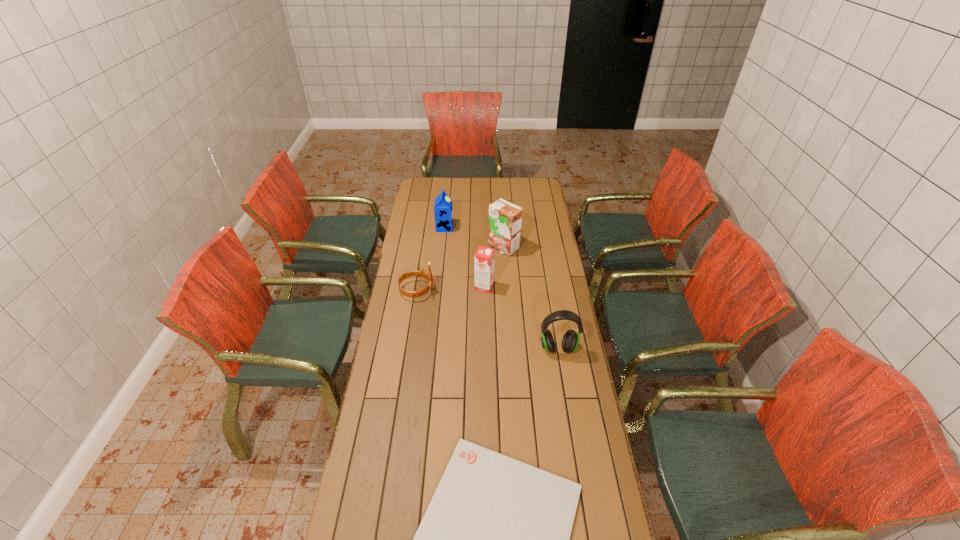
The height and width of the screenshot is (540, 960). I want to click on empty location between the second nearest object and the farthest carton, so click(501, 288).

Where is `vacant space that's between the farthest carton and the second nearest object`? vacant space that's between the farthest carton and the second nearest object is located at coordinates (501, 288).

Locate an element on the screen. object that stands as the fifth closest to the farthest object is located at coordinates (494, 539).

Identify which object is located as the third nearest to the fifth farthest object. Please provide its 2D coordinates. Your answer should be formatted as a tuple, i.e. [(x, y)], where the tuple contains the x and y coordinates of a point satisfying the conditions above.

[(418, 293)]

Locate an element on the screen. carton that is the closest to the headset is located at coordinates (484, 258).

You are a GUI agent. You are given a task and a screenshot of the screen. Output one action in this format:
    pyautogui.click(x=<x>, y=<y>)
    Task: Click on the closest carton to the farthest object
    The image size is (960, 540).
    Given the screenshot: What is the action you would take?
    pyautogui.click(x=505, y=219)

Where is `vacant space that satisfies the following two spatial constraints: 1. with the cap open on the leftmost carton; 2. on the right side of the nearest carton`? vacant space that satisfies the following two spatial constraints: 1. with the cap open on the leftmost carton; 2. on the right side of the nearest carton is located at coordinates (439, 286).